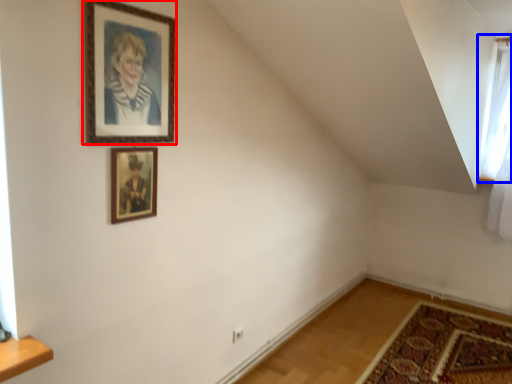
Question: Among these objects, which one is nearest to the camera, picture frame (highlighted by a red box) or window (highlighted by a blue box)?

Choices:
 (A) picture frame
 (B) window

Answer: (A)